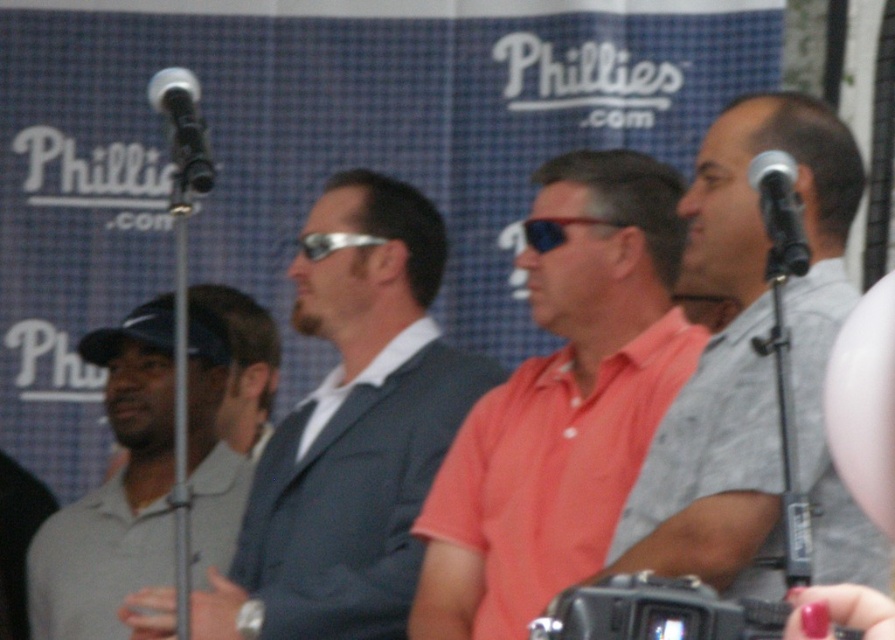
Does matte gray suit at center come behind silver metallic microphone at upper right?

Yes.

The image size is (895, 640). Describe the element at coordinates (354, 432) in the screenshot. I see `matte gray suit at center` at that location.

The image size is (895, 640). I want to click on matte gray suit at center, so click(x=354, y=432).

This screenshot has height=640, width=895. Find the location of `silver metallic microphone at upper right`. silver metallic microphone at upper right is located at coordinates (780, 214).

Does silver metallic microphone at upper right have a larger size compared to silver metallic microphone at upper left?

Incorrect, silver metallic microphone at upper right is not larger than silver metallic microphone at upper left.

This screenshot has height=640, width=895. I want to click on silver metallic microphone at upper right, so click(780, 214).

What do you see at coordinates (655, 611) in the screenshot?
I see `black plastic camera at lower center` at bounding box center [655, 611].

Is point (604, 600) positioned before point (763, 225)?

Yes, it is.

Where is `black plastic camera at lower center`? This screenshot has height=640, width=895. black plastic camera at lower center is located at coordinates (655, 611).